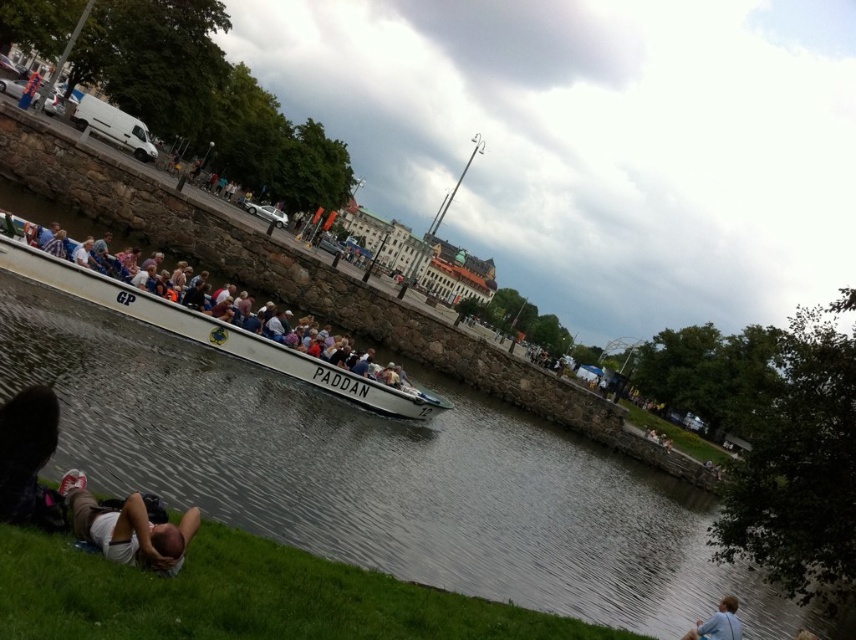
Question: Which of these objects is positioned closest to the white matte boat at center?

Choices:
 (A) clear water at center
 (B) green grass at lower left

Answer: (A)

Question: Which object appears closest to the camera in this image?

Choices:
 (A) blue fabric shirt at lower right
 (B) white matte boat at center
 (C) green grass at lower left

Answer: (C)

Question: Is clear water at center positioned behind blue fabric shirt at lower right?

Choices:
 (A) yes
 (B) no

Answer: (B)

Question: Can you confirm if green grass at lower left is positioned to the right of white matte boat at center?

Choices:
 (A) yes
 (B) no

Answer: (A)

Question: Which is farther from the blue fabric shirt at lower right?

Choices:
 (A) white matte boat at center
 (B) white fabric person at lower left

Answer: (B)

Question: Is the position of white matte boat at center more distant than that of blue fabric shirt at lower right?

Choices:
 (A) yes
 (B) no

Answer: (A)